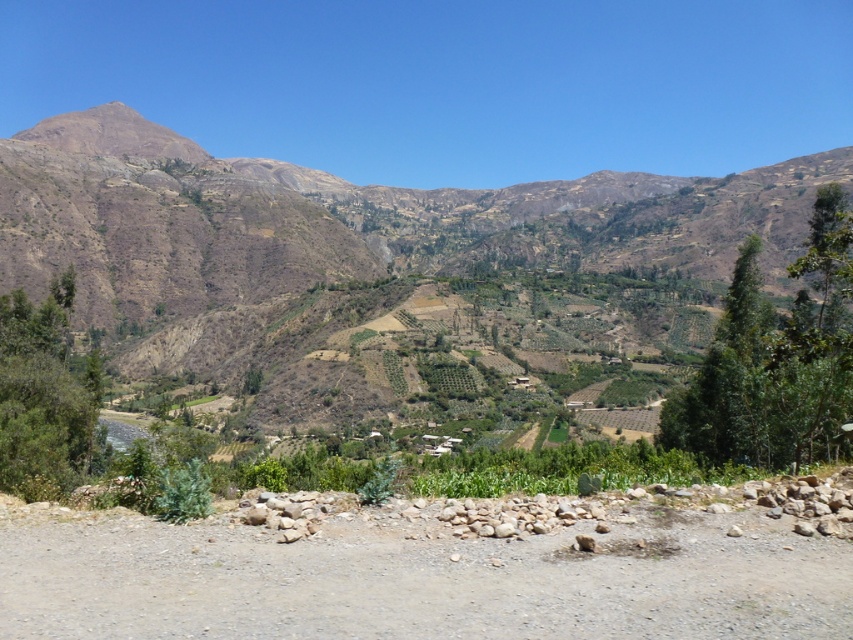
Question: Which object appears farthest from the camera in this image?

Choices:
 (A) dusty gravel dirt track at lower center
 (B) brown/drymountain at upper center

Answer: (B)

Question: Which of the following is the farthest from the observer?

Choices:
 (A) dusty gravel dirt track at lower center
 (B) brown/drymountain at upper center

Answer: (B)

Question: Is brown/drymountain at upper center smaller than dusty gravel dirt track at lower center?

Choices:
 (A) no
 (B) yes

Answer: (A)

Question: Can you confirm if brown/drymountain at upper center is positioned to the left of dusty gravel dirt track at lower center?

Choices:
 (A) yes
 (B) no

Answer: (A)

Question: Does brown/drymountain at upper center appear on the left side of dusty gravel dirt track at lower center?

Choices:
 (A) yes
 (B) no

Answer: (A)